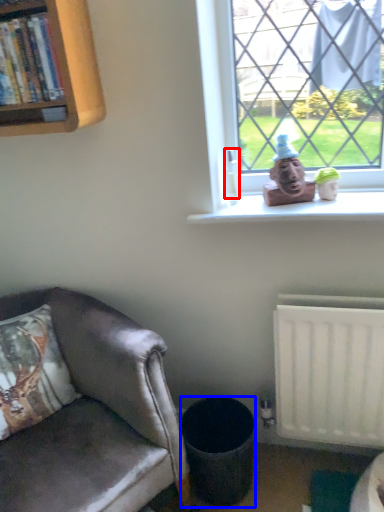
Question: Among these objects, which one is nearest to the camera, coffee cup (highlighted by a red box) or trash bin/can (highlighted by a blue box)?

Choices:
 (A) coffee cup
 (B) trash bin/can

Answer: (B)